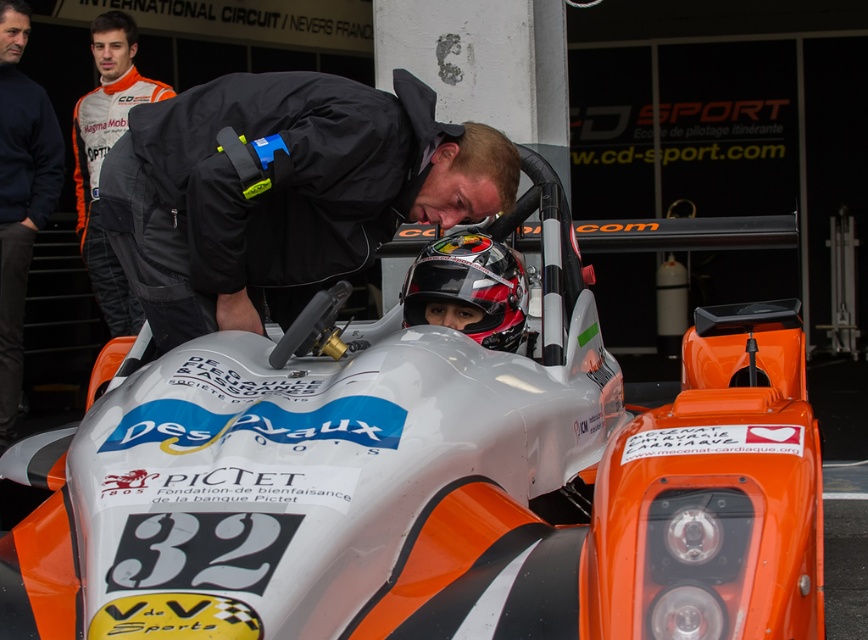
Can you confirm if orange matte race car at center is bigger than orange/white racing suit at upper left?

Correct, orange matte race car at center is larger in size than orange/white racing suit at upper left.

Between point (225, 609) and point (110, 312), which one is positioned in front?

Point (225, 609)

The width and height of the screenshot is (868, 640). What are the coordinates of `orange matte race car at center` in the screenshot? It's located at (424, 483).

Image resolution: width=868 pixels, height=640 pixels. I want to click on orange matte race car at center, so click(x=424, y=483).

Is black matte jacket at center shorter than navy blue sweatshirt at left?

Indeed, black matte jacket at center has a lesser height compared to navy blue sweatshirt at left.

Does black matte jacket at center appear under navy blue sweatshirt at left?

Yes.

Does point (241, 298) come farther from viewer compared to point (12, 157)?

No.

The width and height of the screenshot is (868, 640). I want to click on black matte jacket at center, so click(283, 192).

Does navy blue sweatshirt at left appear over orange/white racing suit at upper left?

No, navy blue sweatshirt at left is not above orange/white racing suit at upper left.

Between navy blue sweatshirt at left and orange/white racing suit at upper left, which one is positioned lower?

navy blue sweatshirt at left is lower down.

The image size is (868, 640). What are the coordinates of `navy blue sweatshirt at left` in the screenshot? It's located at (20, 195).